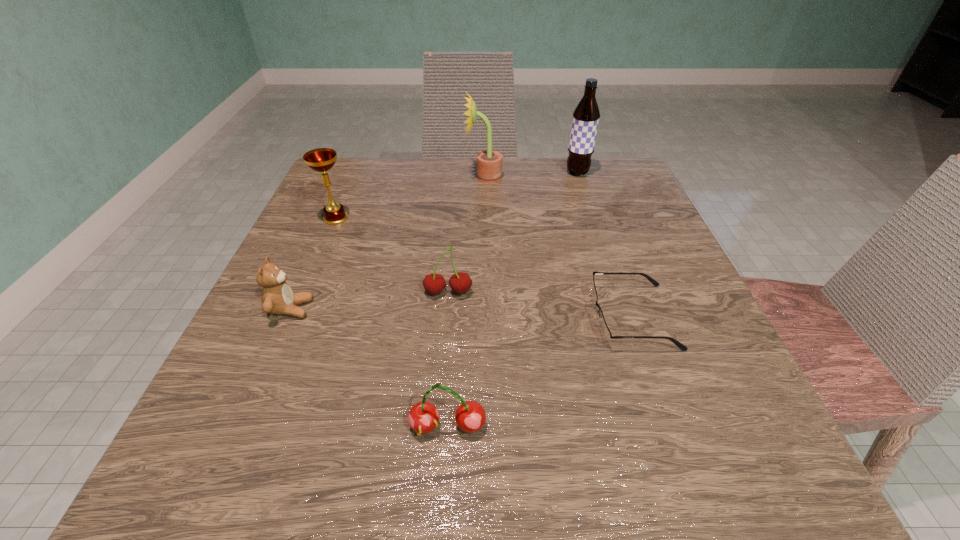
This screenshot has width=960, height=540. Identify the location of free spot between the sunflower and the teddy bear. (388, 243).

Locate an element on the screen. This screenshot has height=540, width=960. free spot between the farther cherry and the fifth shortest object is located at coordinates (392, 255).

Find the location of a particular element. This screenshot has height=540, width=960. free space between the spectacles and the root beer is located at coordinates (605, 245).

Identify the location of free space between the fifth nearest object and the nearer cherry. (392, 322).

Find the location of a particular element. object that stands as the second closest to the spectacles is located at coordinates (470, 416).

Identify the location of object that is the sixth closest to the root beer. (470, 416).

At what (x,y) coordinates should I click in order to perform the action: click on free space that satisfies the following two spatial constraints: 1. on the face of the sunflower; 2. on the front side of the third farthest object. Please return your answer as a coordinate pair (x, y). Image resolution: width=960 pixels, height=540 pixels. Looking at the image, I should click on (484, 218).

Locate an element on the screen. The image size is (960, 540). blank space that satisfies the following two spatial constraints: 1. on the back side of the root beer; 2. on the left side of the chalice is located at coordinates (355, 173).